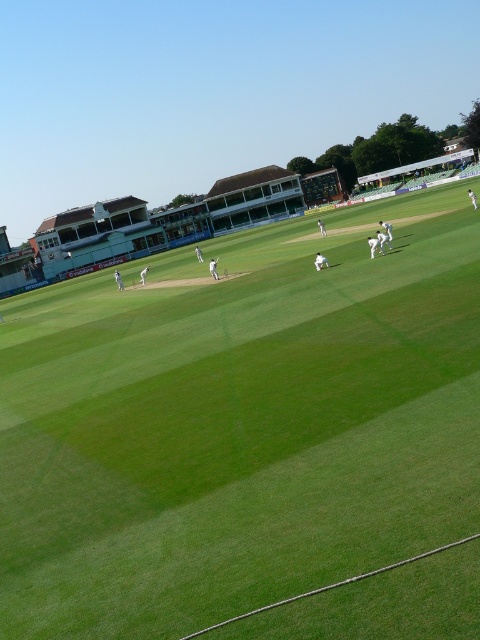
You are a photographer positioned at the center of the cricket field. You want to take a photo that includes both the point at coordinates point (173, 416) and point (317, 257). Which point should you focus on first to ensure both are in sharp focus?

Since point (173, 416) is closer to the viewer than point (317, 257), you should focus on point (173, 416) first to ensure both are in sharp focus.

In the scene shown: You are standing at the edge of the green grass cricket field at center and want to throw a ball to a friend who is standing 4 meters away from you. Can you reach them by throwing the ball straight ahead?

The green grass cricket field at center is 3.88 meters away from the viewer, so if you are standing at the edge, you can throw the ball straight ahead to reach your friend who is 4 meters away.